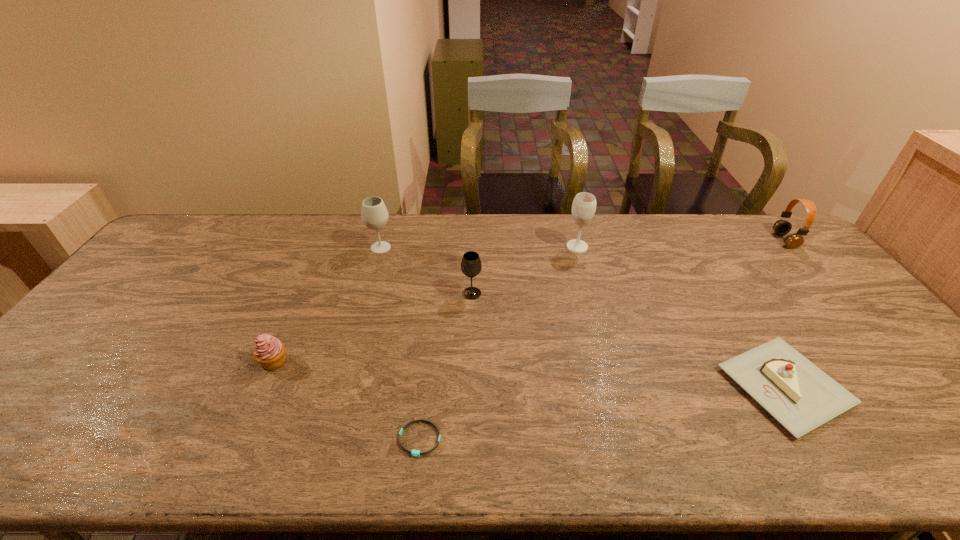
This screenshot has width=960, height=540. Find the location of `cake at the near edge`. cake at the near edge is located at coordinates (800, 396).

You are a GUI agent. You are given a task and a screenshot of the screen. Output one action in this format:
    pyautogui.click(x=<x>, y=<y>)
    Task: Click on the wristband at the near edge
    The width and height of the screenshot is (960, 540).
    Given the screenshot: What is the action you would take?
    pyautogui.click(x=415, y=453)

Identify the location of object that is at the right edge. (782, 227).

Where is `object that is positioned at the far right corner`? This screenshot has width=960, height=540. object that is positioned at the far right corner is located at coordinates (782, 227).

The image size is (960, 540). I want to click on free spot at the far edge of the desktop, so click(x=660, y=235).

At what (x,y) coordinates should I click in order to perform the action: click on free region at the near edge of the desktop. Please return your answer as a coordinate pair (x, y). This screenshot has height=540, width=960. Looking at the image, I should click on (117, 465).

At what (x,y) coordinates should I click in order to perform the action: click on free point at the far left corner. Please return your answer as a coordinate pair (x, y). Looking at the image, I should click on (174, 233).

Where is `free space between the headset and the sixth tallest object`? free space between the headset and the sixth tallest object is located at coordinates (784, 314).

The image size is (960, 540). I want to click on vacant space that's between the wristband and the nearest wineglass, so click(445, 366).

At what (x,y) coordinates should I click in order to perform the action: click on free space between the wristband and the fourth object from right to left. Please return your answer as a coordinate pair (x, y). Image resolution: width=960 pixels, height=540 pixels. Looking at the image, I should click on (445, 366).